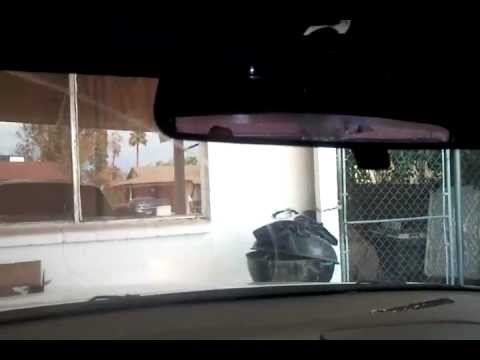
Find the location of a particular element. Image resolution: width=480 pixels, height=360 pixels. window frame is located at coordinates (204, 198).